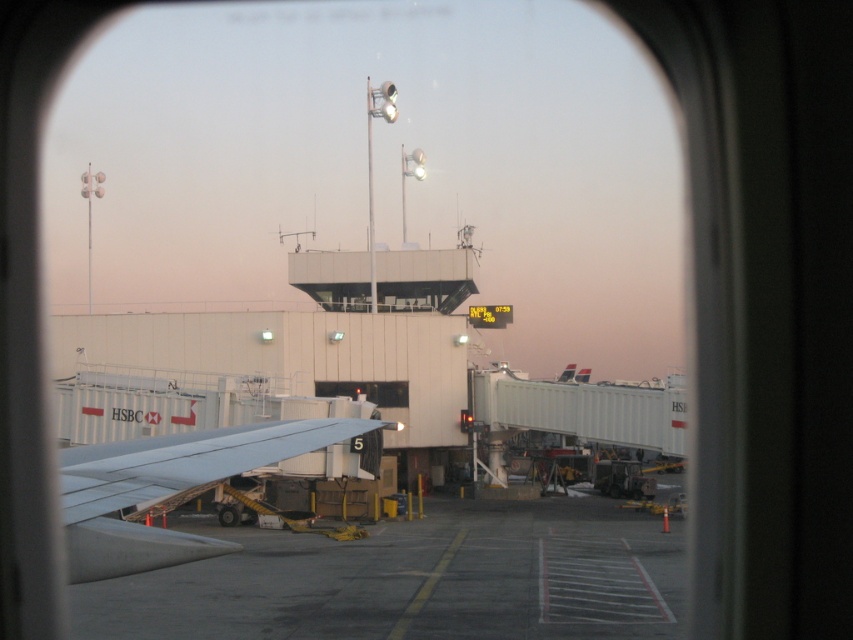
Question: Can you confirm if gray concrete tarmac at center is wider than light gray metallic wing at lower left?

Choices:
 (A) no
 (B) yes

Answer: (B)

Question: Which point is farther from the camera taking this photo?

Choices:
 (A) (637, 541)
 (B) (397, 390)

Answer: (B)

Question: Can you confirm if gray concrete tarmac at center is positioned to the left of light gray metallic wing at lower left?

Choices:
 (A) yes
 (B) no

Answer: (B)

Question: Is gray concrete tarmac at center below transparent glass window at center?

Choices:
 (A) no
 (B) yes

Answer: (B)

Question: Which point is farther to the camera?

Choices:
 (A) transparent glass window at center
 (B) light gray metallic wing at lower left
 (C) gray concrete tarmac at center

Answer: (A)

Question: Which object appears closest to the camera in this image?

Choices:
 (A) transparent glass window at center
 (B) light gray metallic wing at lower left
 (C) gray concrete tarmac at center

Answer: (B)